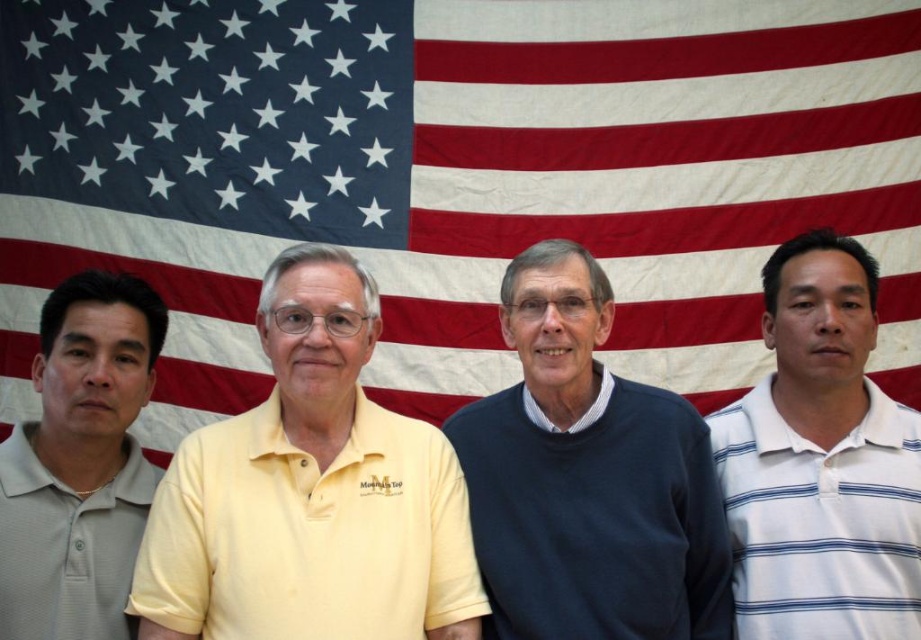
You are standing in front of the American flag and see two points marked on the ground. One is at point [561,428] and the other at point [101,445]. Which point is closer to you?

Point [101,445] is closer to you because it is in front of point [561,428].

You are standing in front of the American flag and need to find the yellow cotton polo shirt at center. Based on the coordinates provided, which direction should you look relative to the flag?

The yellow cotton polo shirt at center is located at coordinates point (311, 493), which means it is positioned to the right and slightly below the center of the flag. You should look towards the lower right area near the flag to find it.

You are a photographer trying to adjust the lighting for a group photo. You notice the dark blue sweater at center and the gray matte polo shirt at left. Which clothing item is covering part of the other?

The dark blue sweater at center is positioned over the gray matte polo shirt at left, so it is covering part of the gray matte polo shirt at left.